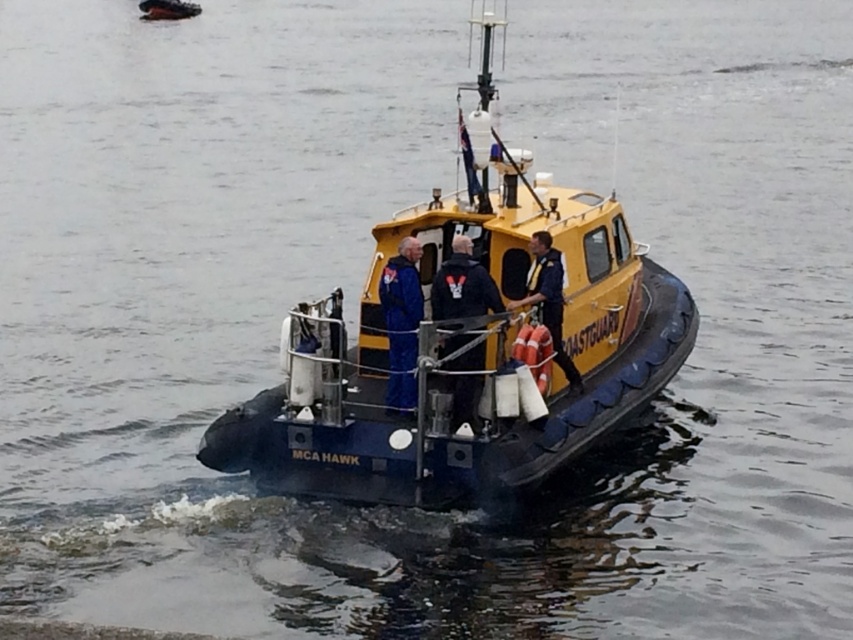
Question: Does yellow rubber boat at center appear on the right side of blue fabric jacket at center?

Choices:
 (A) yes
 (B) no

Answer: (A)

Question: Which object is positioned farthest from the yellow rubber life jacket at center?

Choices:
 (A) yellow rubber boat at center
 (B) blue fabric jacket at center

Answer: (B)

Question: Which of the following is the farthest from the observer?

Choices:
 (A) yellow rubber boat at center
 (B) yellow rubber life jacket at center
 (C) blue fabric jacket at center

Answer: (B)

Question: Which point is closer to the camera taking this photo?

Choices:
 (A) tap(549, 340)
 (B) tap(558, 317)

Answer: (A)

Question: Considering the relative positions of yellow rubber life jacket at center and orange fabric life jacket at center in the image provided, where is yellow rubber life jacket at center located with respect to orange fabric life jacket at center?

Choices:
 (A) right
 (B) left

Answer: (A)

Question: Observing the image, what is the correct spatial positioning of blue fabric jacket at center in reference to yellow rubber life jacket at center?

Choices:
 (A) left
 (B) right

Answer: (A)